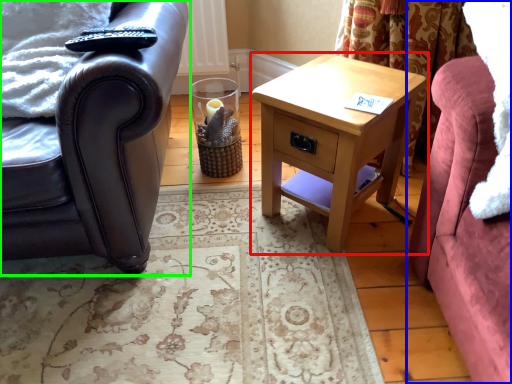
Question: Estimate the real-world distances between objects in this image. Which object is farther from nightstand (highlighted by a red box), studio couch (highlighted by a blue box) or chair (highlighted by a green box)?

Choices:
 (A) studio couch
 (B) chair

Answer: (B)